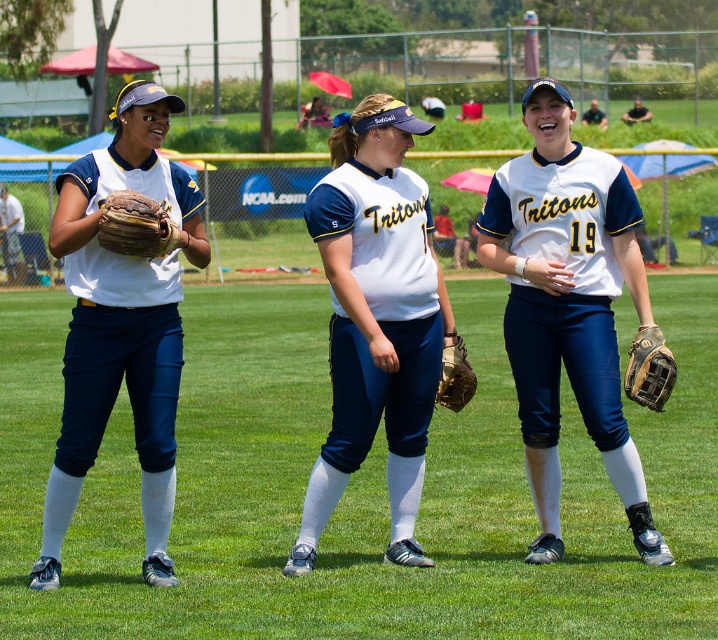
You are a field maintenance worker who needs to place a 3.0 meter long fence post between the white matte jersey at left and the brown leather baseball glove at lower right. Can you fit the fence post between them?

The distance between the white matte jersey at left and the brown leather baseball glove at lower right is 2.90 meters. Since the fence post is 3.0 meters long, it cannot fit between them as the space is slightly shorter than the post.

You are standing on the field and want to walk towards both the point at coordinate [668,356] and the point at coordinate [447,388]. Which point should you reach first?

You should reach the point at coordinate [668,356] first because it is closer to you than the point at coordinate [447,388].

You are standing at the point labeled as point (638, 394) on the field. A teammate is approaching you from the direction of the NCAA.com banner in the background. If you want to move 3 meters away from your current position towards the Tritons players, which direction should you go?

Since the point (638, 394) is 8.49 meters away from the viewer, moving 3 meters away from this position would require moving in the direction away from the viewer, which is towards the NCAA.com banner in the background where your teammate is coming from. However, since the teammate is approaching from that direction, moving towards the banner would increase the distance between you and the viewer, but you should specify the direction relative to the field layout. Alternatively, perhaps moving towards the